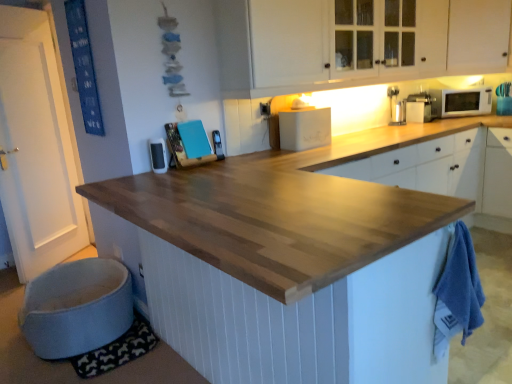
You are a GUI agent. You are given a task and a screenshot of the screen. Output one action in this format:
    pyautogui.click(x=<x>, y=<y>)
    Task: Click on the free spot in front of white glossy microwave at upper center, which is counted as the 1th appliance, starting from the front
    This screenshot has width=512, height=384.
    Given the screenshot: What is the action you would take?
    pyautogui.click(x=147, y=174)